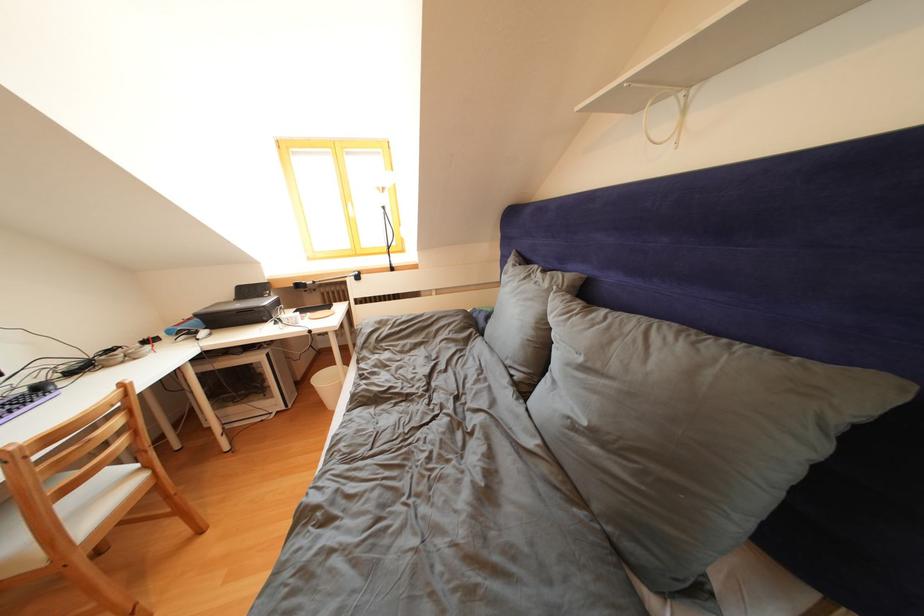
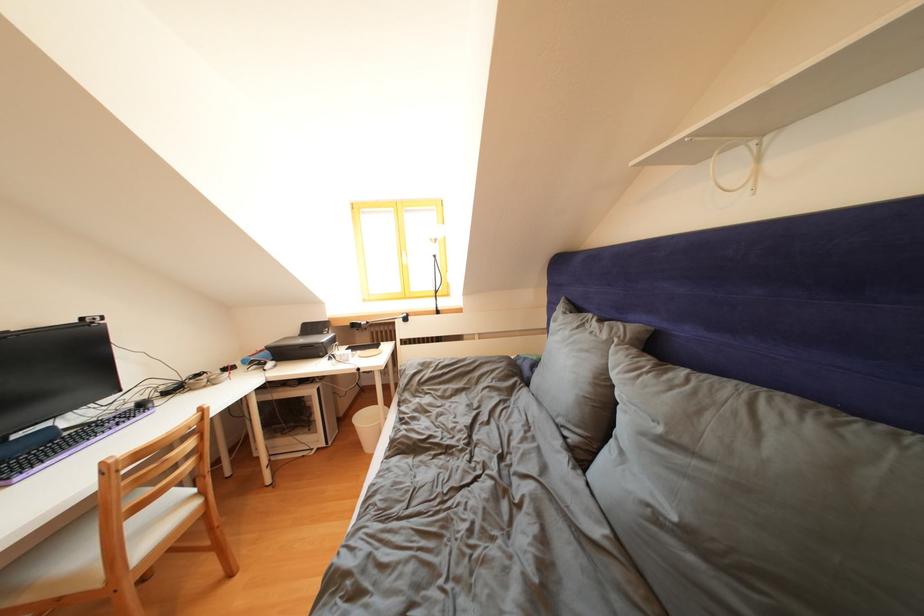
Locate, in the second image, the point that corresponds to (256,296) in the first image.

(319, 333)